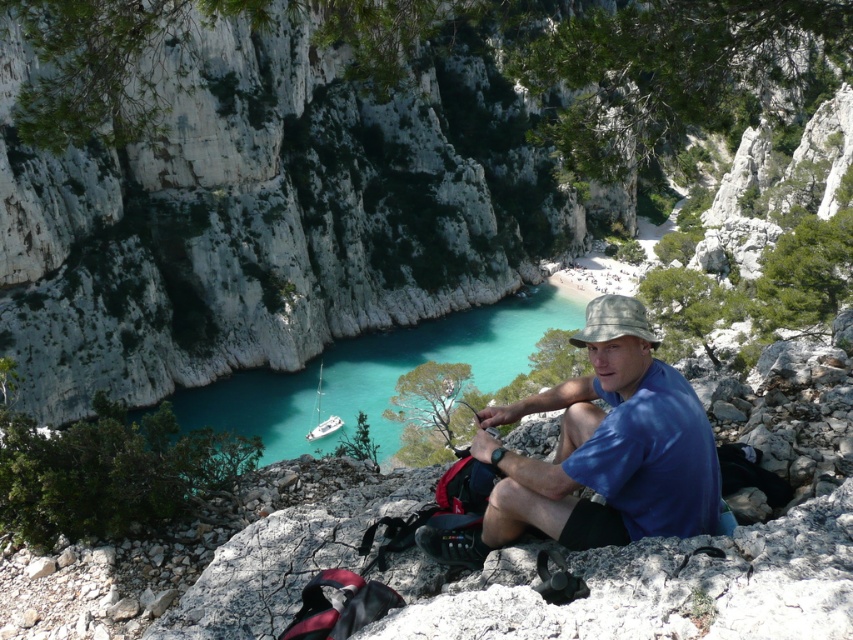
Question: Does blue cotton shirt at center appear on the left side of camouflage fabric baseball hat at center?

Choices:
 (A) yes
 (B) no

Answer: (A)

Question: Is blue cotton shirt at center wider than camouflage fabric baseball hat at center?

Choices:
 (A) yes
 (B) no

Answer: (B)

Question: Which of the following is the closest to the observer?

Choices:
 (A) (605, 296)
 (B) (573, 435)

Answer: (B)

Question: Can you confirm if blue cotton shirt at center is smaller than camouflage fabric baseball hat at center?

Choices:
 (A) yes
 (B) no

Answer: (A)